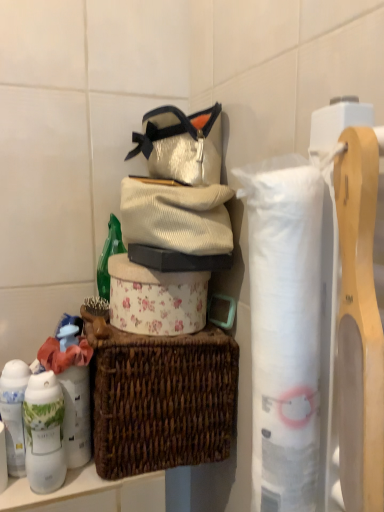
Question: Can we say white paper towel at right, which is the 2th toilet paper from back to front, lies outside brown woven picnic basket at center?

Choices:
 (A) yes
 (B) no

Answer: (A)

Question: Is white paper towel at right, which is the 2th toilet paper from back to front, positioned behind brown woven picnic basket at center?

Choices:
 (A) yes
 (B) no

Answer: (B)

Question: Is white paper towel at right, which is the 2th toilet paper from back to front, positioned with its back to brown woven picnic basket at center?

Choices:
 (A) no
 (B) yes

Answer: (A)

Question: From the image's perspective, would you say white paper towel at right, which is the 2th toilet paper from back to front, is positioned over brown woven picnic basket at center?

Choices:
 (A) yes
 (B) no

Answer: (A)

Question: Considering the relative sizes of white paper towel at right, which is the 2th toilet paper from back to front, and brown woven picnic basket at center in the image provided, is white paper towel at right, which is the 2th toilet paper from back to front, smaller than brown woven picnic basket at center?

Choices:
 (A) yes
 (B) no

Answer: (A)

Question: Does white paper towel at right, which is the 2th toilet paper from back to front, have a lesser height compared to brown woven picnic basket at center?

Choices:
 (A) no
 (B) yes

Answer: (A)

Question: Is brown woven picnic basket at center completely or partially outside of white matte canister at left, which appears as the 2th toiletry when viewed from the left?

Choices:
 (A) no
 (B) yes

Answer: (B)

Question: Is brown woven picnic basket at center far away from white matte canister at left, the 1th toiletry in the right-to-left sequence?

Choices:
 (A) yes
 (B) no

Answer: (B)

Question: Does brown woven picnic basket at center appear on the left side of white matte canister at left, the 1th toiletry in the right-to-left sequence?

Choices:
 (A) no
 (B) yes

Answer: (A)

Question: Would you say white matte canister at left, which appears as the 2th toiletry when viewed from the left, is part of brown woven picnic basket at center's contents?

Choices:
 (A) no
 (B) yes

Answer: (A)

Question: Is brown woven picnic basket at center positioned before white matte canister at left, the 1th toiletry in the right-to-left sequence?

Choices:
 (A) yes
 (B) no

Answer: (B)

Question: Can you confirm if brown woven picnic basket at center is wider than white matte canister at left, the 1th toiletry in the right-to-left sequence?

Choices:
 (A) no
 (B) yes

Answer: (B)

Question: Is white paper towel at right, which is counted as the first toilet paper, starting from the right, to the left of corduroy sweater at center from the viewer's perspective?

Choices:
 (A) yes
 (B) no

Answer: (B)